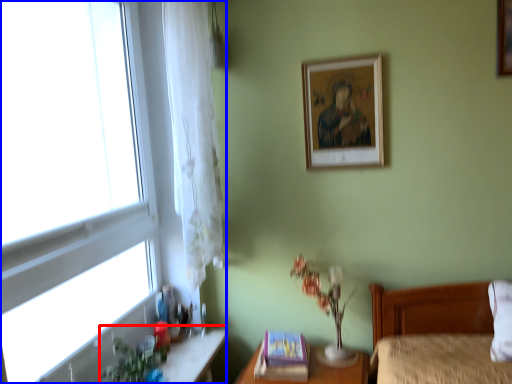
Question: Among these objects, which one is farthest to the camera, vanity (highlighted by a red box) or window (highlighted by a blue box)?

Choices:
 (A) vanity
 (B) window

Answer: (A)